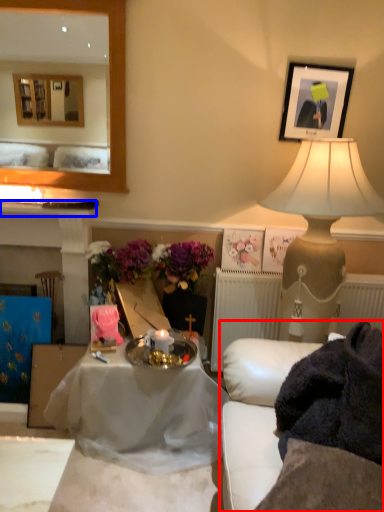
Question: Among these objects, which one is nearest to the camera, studio couch (highlighted by a red box) or mantle (highlighted by a blue box)?

Choices:
 (A) studio couch
 (B) mantle

Answer: (A)